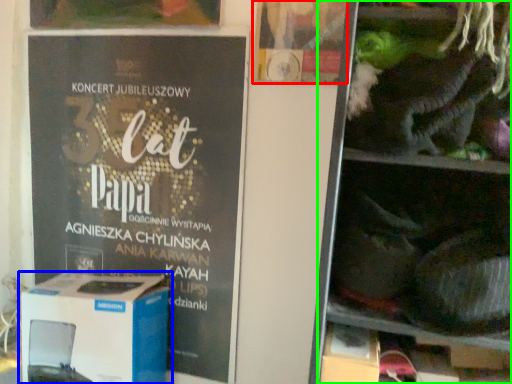
Question: Considering the real-world distances, which object is farthest from flyer (highlighted by a red box)? box (highlighted by a blue box) or shelf (highlighted by a green box)?

Choices:
 (A) box
 (B) shelf

Answer: (A)